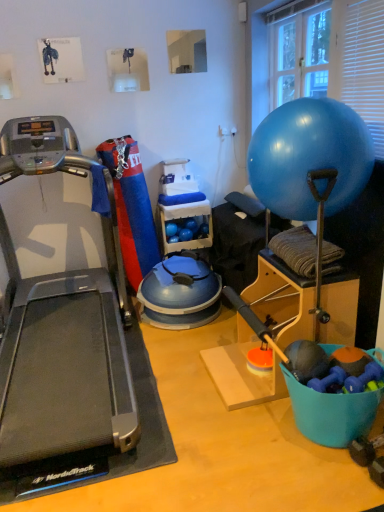
This screenshot has height=512, width=384. I want to click on free space above blue plastic bucket at lower right (from a real-world perspective), so click(x=347, y=359).